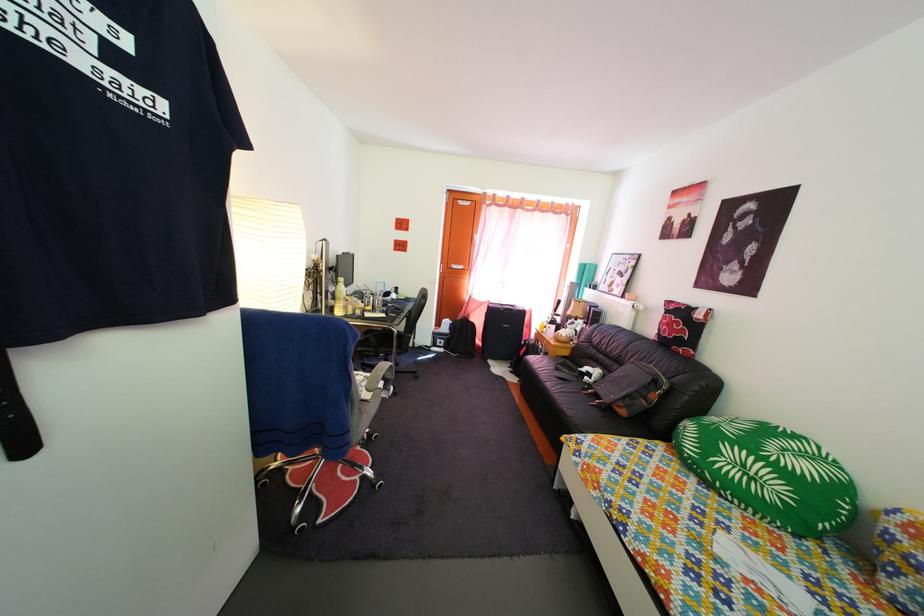
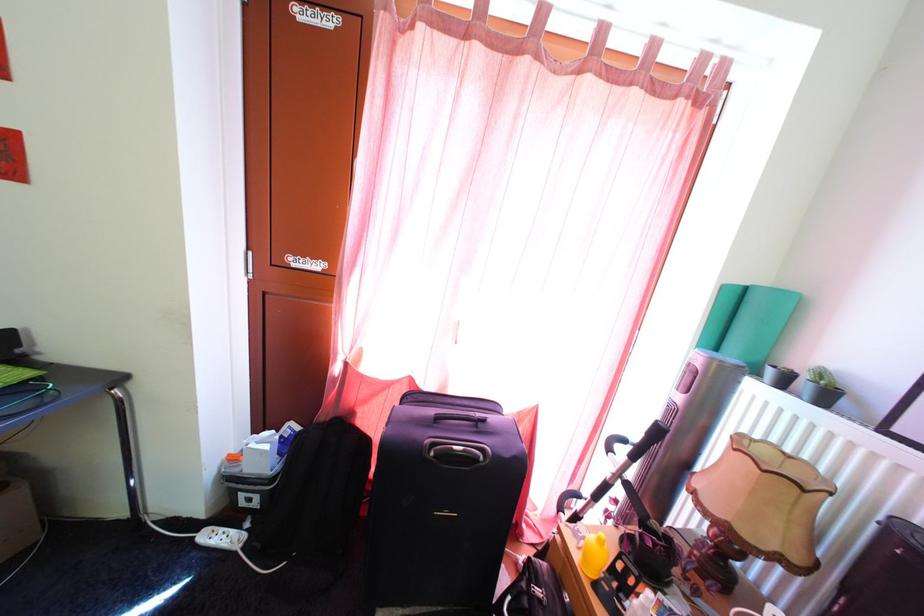
In the second image, find the point that corresponds to pixel 451 353 in the first image.

(264, 512)